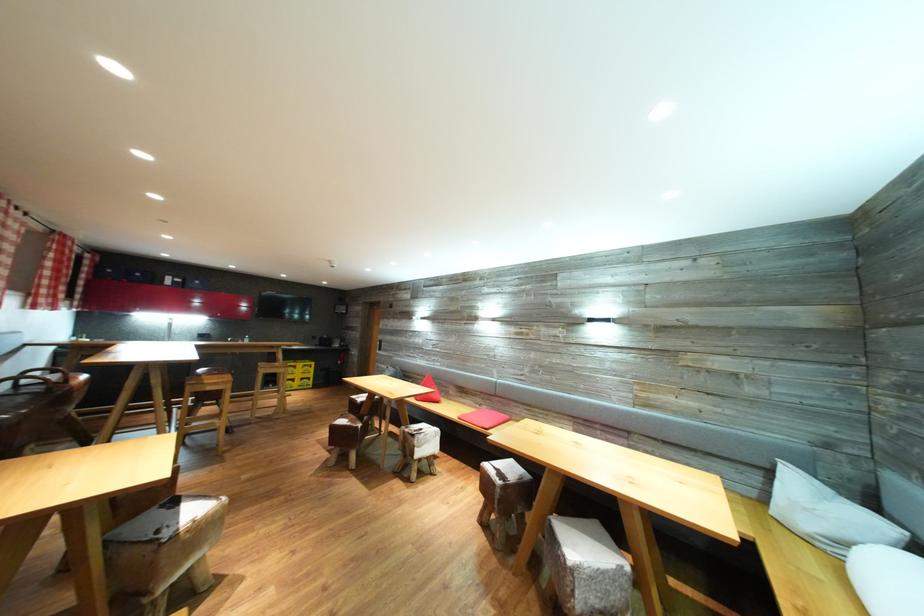
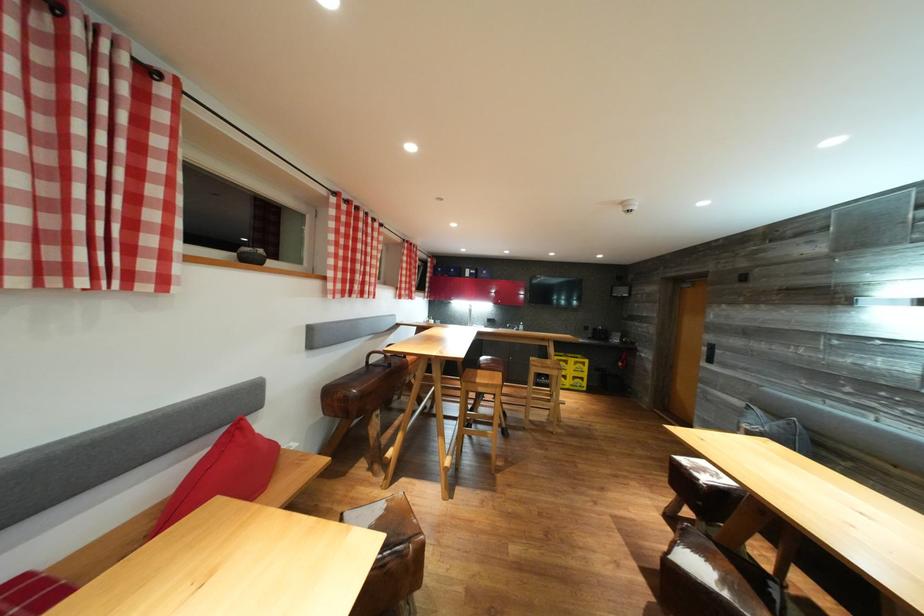
The point at (223,389) is marked in the first image. Where is the corresponding point in the second image?

(492, 391)